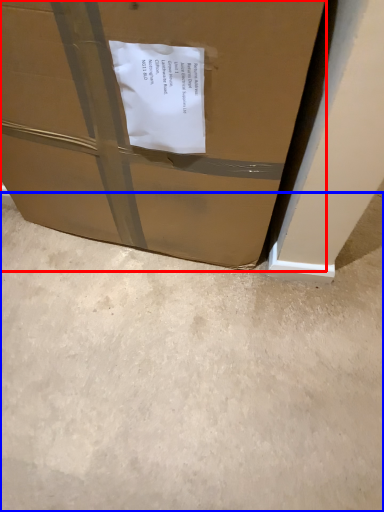
Question: Which point is further to the camera, box (highlighted by a red box) or concrete (highlighted by a blue box)?

Choices:
 (A) box
 (B) concrete

Answer: (B)